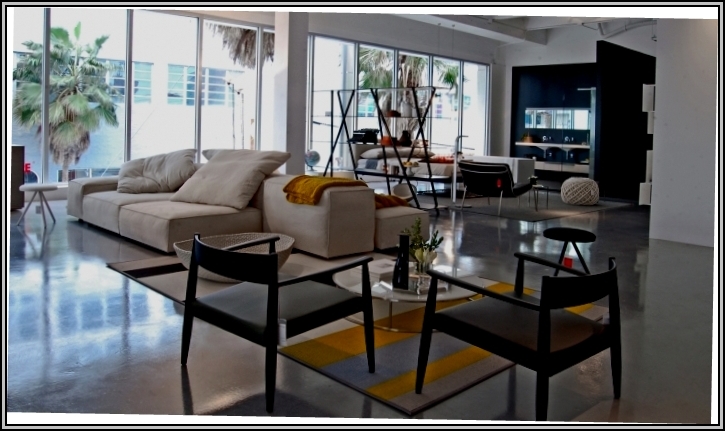
Image resolution: width=725 pixels, height=431 pixels. I want to click on area rugs, so click(x=391, y=364), click(x=526, y=210).